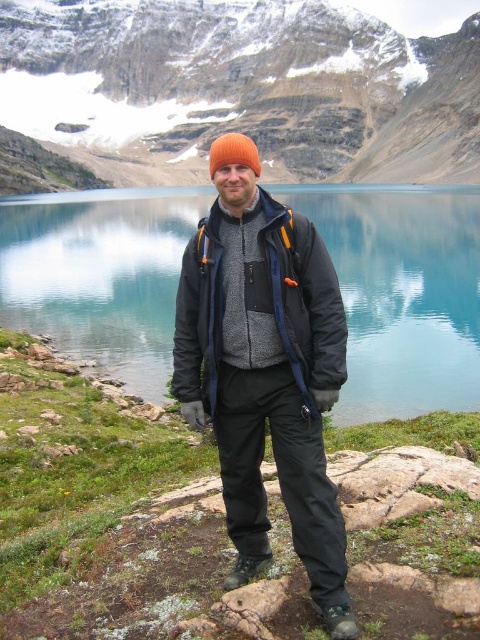
Question: Does teal glossy water at center lie behind matte black jacket at center?

Choices:
 (A) yes
 (B) no

Answer: (A)

Question: Which point is farther to the camera?

Choices:
 (A) teal glossy water at center
 (B) snowy rock mountain at upper center
 (C) brushed wool jacket at center
 (D) orange knit hat at center

Answer: (B)

Question: Is snowy rock mountain at upper center in front of teal glossy water at center?

Choices:
 (A) yes
 (B) no

Answer: (B)

Question: Among these objects, which one is nearest to the camera?

Choices:
 (A) orange knit hat at center
 (B) matte black jacket at center
 (C) teal glossy water at center

Answer: (B)

Question: Can you confirm if brushed wool jacket at center is thinner than orange knit hat at center?

Choices:
 (A) yes
 (B) no

Answer: (A)

Question: Which of the following is the closest to the observer?

Choices:
 (A) pyautogui.click(x=239, y=132)
 (B) pyautogui.click(x=223, y=317)

Answer: (B)